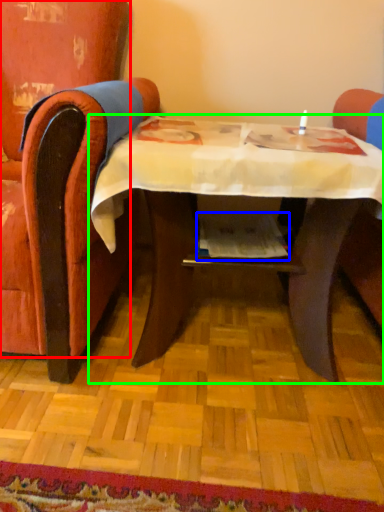
Question: Based on their relative distances, which object is nearer to chair (highlighted by a red box)? Choose from magazine (highlighted by a blue box) and table (highlighted by a green box).

Choices:
 (A) magazine
 (B) table

Answer: (B)